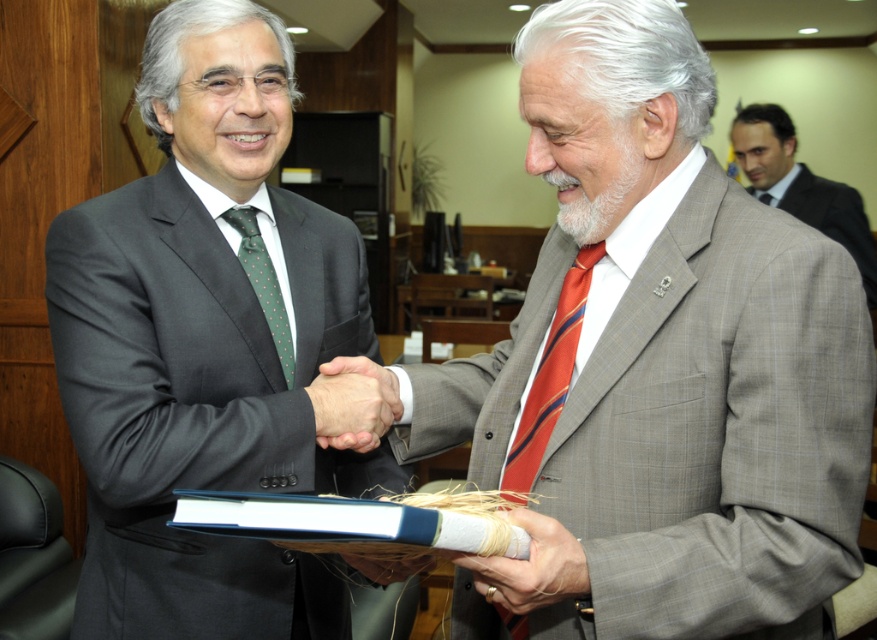
Who is lower down, gray textured suit at center or matte black suit at center?

gray textured suit at center

Between point (605, 145) and point (176, 300), which one is positioned in front?

Positioned in front is point (605, 145).

Where is `gray textured suit at center`? This screenshot has width=877, height=640. gray textured suit at center is located at coordinates (661, 360).

Does gray textured suit at center appear over green dotted tie at left?

Actually, gray textured suit at center is below green dotted tie at left.

Who is more forward, (816, 259) or (257, 289)?

Point (816, 259) is in front.

Where is `gray textured suit at center`? gray textured suit at center is located at coordinates (661, 360).

Can you confirm if gray textured suit at center is shorter than gray textured suit at upper right?

Indeed, gray textured suit at center has a lesser height compared to gray textured suit at upper right.

Between point (845, 337) and point (839, 221), which one is positioned in front?

Point (845, 337) is more forward.

At what (x,y) coordinates should I click in order to perform the action: click on gray textured suit at center. Please return your answer as a coordinate pair (x, y). The image size is (877, 640). Looking at the image, I should click on (661, 360).